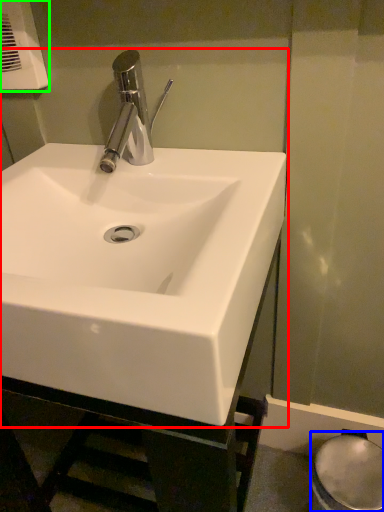
Question: Estimate the real-world distances between objects in this image. Which object is farther from sink (highlighted by a red box), bidet (highlighted by a blue box) or hand dryer (highlighted by a green box)?

Choices:
 (A) bidet
 (B) hand dryer

Answer: (A)